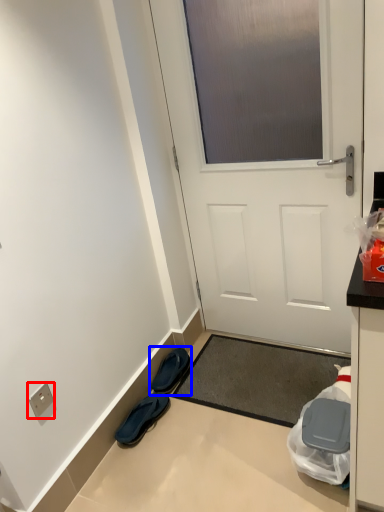
Question: Among these objects, which one is farthest to the camera, electric outlet (highlighted by a red box) or footwear (highlighted by a blue box)?

Choices:
 (A) electric outlet
 (B) footwear

Answer: (B)